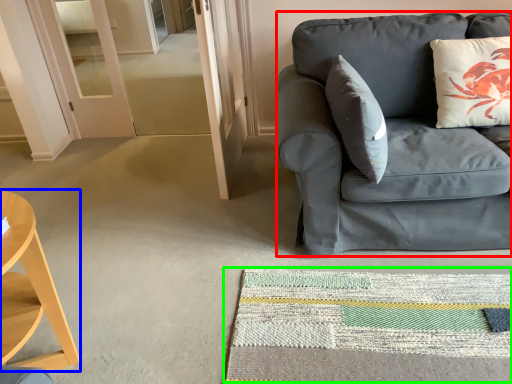
Question: Which object is the farthest from studio couch (highlighted by a red box)? Choose among these: desk (highlighted by a blue box) or mat (highlighted by a green box).

Choices:
 (A) desk
 (B) mat

Answer: (A)